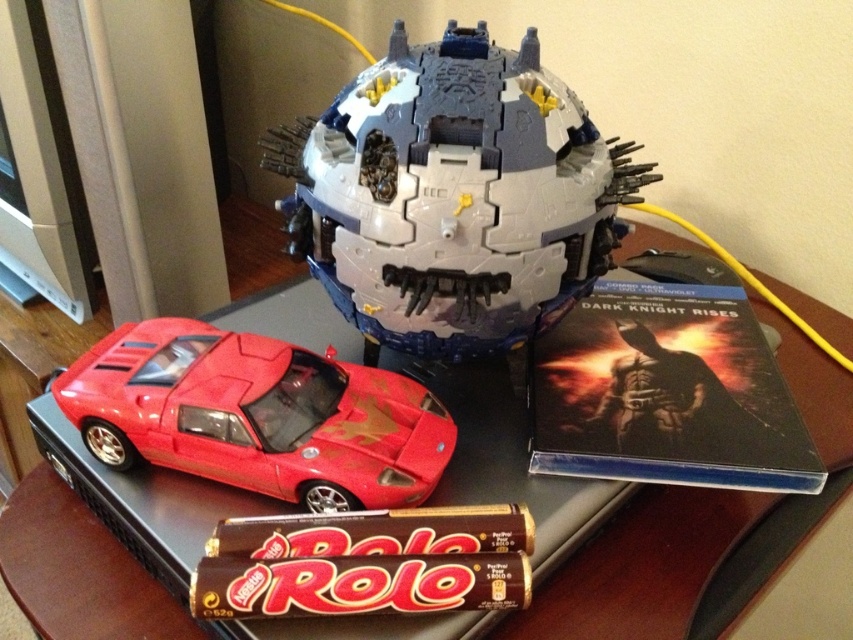
From the picture: Who is positioned more to the right, shiny black table at center or shiny red car at lower left?

shiny black table at center is more to the right.

Can you confirm if shiny black table at center is thinner than shiny red car at lower left?

In fact, shiny black table at center might be wider than shiny red car at lower left.

The width and height of the screenshot is (853, 640). Identify the location of shiny black table at center. (639, 568).

Find the location of a particular element. shiny black table at center is located at coordinates (639, 568).

Which is below, plastic gray and blue robot head at center or shiny red car at lower left?

shiny red car at lower left is below.

What do you see at coordinates (453, 195) in the screenshot? I see `plastic gray and blue robot head at center` at bounding box center [453, 195].

This screenshot has height=640, width=853. I want to click on plastic gray and blue robot head at center, so click(x=453, y=195).

This screenshot has width=853, height=640. Describe the element at coordinates (256, 416) in the screenshot. I see `shiny red car at lower left` at that location.

This screenshot has width=853, height=640. I want to click on shiny red car at lower left, so click(256, 416).